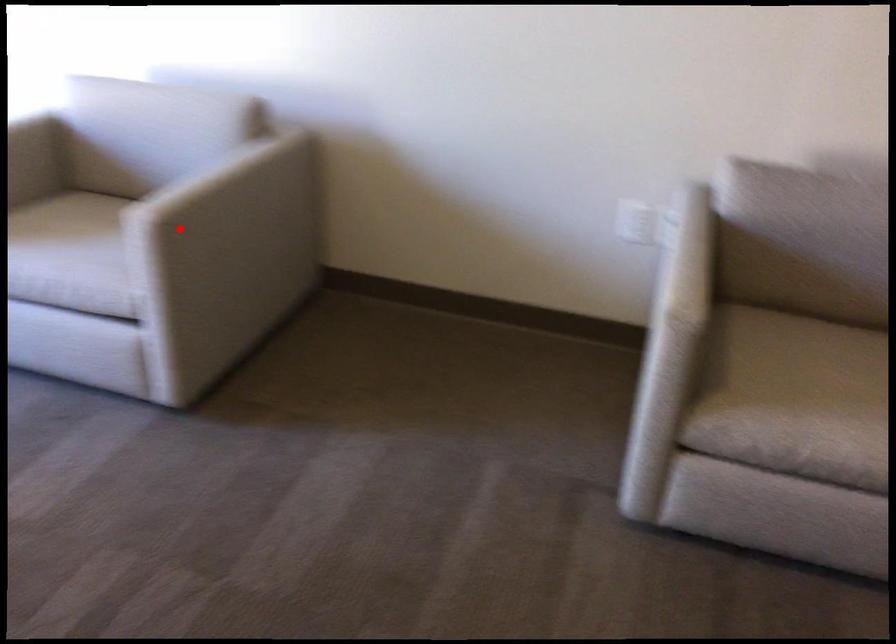
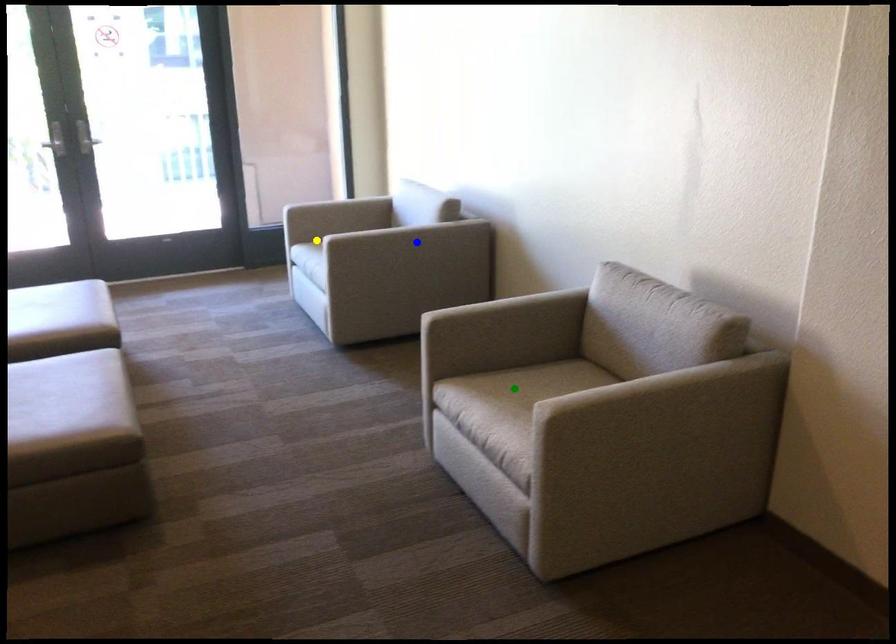
Question: I am providing you with two images of the same scene from different viewpoints. A red point is marked on the first image. You are given multiple points on the second image. Can you choose the point in image 2 that corresponds to the point in image 1?

Choices:
 (A) yellow point
 (B) blue point
 (C) green point

Answer: (A)